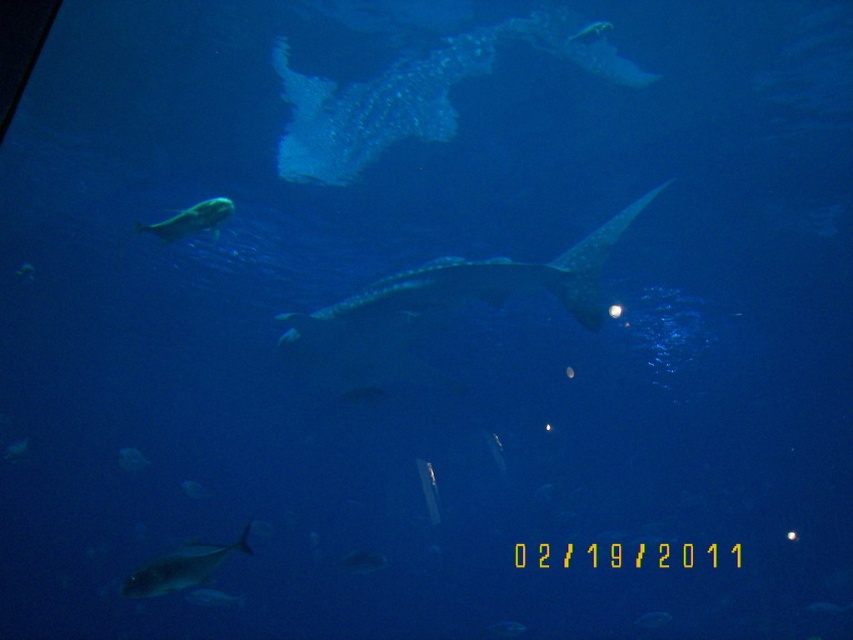
Between translucent blue shark at center and shiny silver fish at bottom left, which one is positioned lower?

Positioned lower is shiny silver fish at bottom left.

Does point (372, 344) come behind point (177, 563)?

Yes, it is behind point (177, 563).

At what (x,y) coordinates should I click in order to perform the action: click on translucent blue shark at center. Please return your answer as a coordinate pair (x, y). This screenshot has width=853, height=640. Looking at the image, I should click on (438, 307).

Is translucent blue shark at center above shiny silver fish at center?

Yes, translucent blue shark at center is above shiny silver fish at center.

Locate an element on the screen. translucent blue shark at center is located at coordinates 438,307.

The height and width of the screenshot is (640, 853). What do you see at coordinates (438, 307) in the screenshot?
I see `translucent blue shark at center` at bounding box center [438, 307].

You are a GUI agent. You are given a task and a screenshot of the screen. Output one action in this format:
    pyautogui.click(x=<x>, y=<y>)
    Task: Click on the translucent blue shark at center
    
    Given the screenshot: What is the action you would take?
    [438, 307]

Does shiny silver fish at upper left appear on the left side of translucent blue fish at upper center?

Correct, you'll find shiny silver fish at upper left to the left of translucent blue fish at upper center.

Is shiny silver fish at upper left further to the viewer compared to translucent blue fish at upper center?

No, shiny silver fish at upper left is in front of translucent blue fish at upper center.

Does point (184, 216) come in front of point (587, 42)?

Yes, point (184, 216) is closer to viewer.

Identify the location of shiny silver fish at upper left. This screenshot has width=853, height=640. (190, 220).